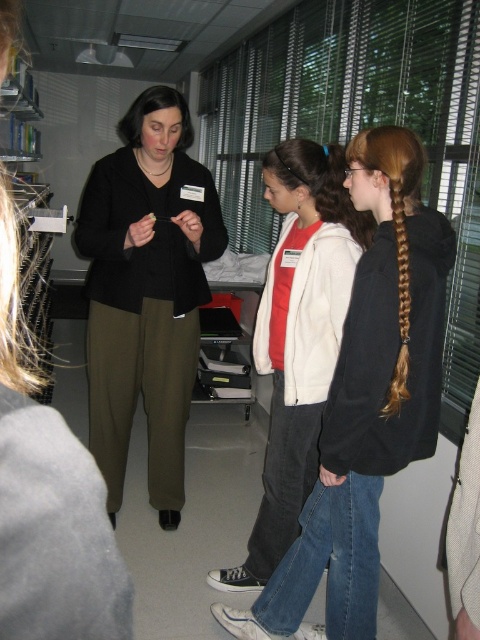
You are an observer in the scene. You notice two items at the center of the image. Which one is covering the other, the black matte sweater at center or the white matte jacket at center?

The black matte sweater at center is positioned over the white matte jacket at center, so it is covering the jacket.

What is the spatial relationship between the black matte sweater at center and the point labeled as point (145, 292)?

The black matte sweater at center is represented by point (145, 292).